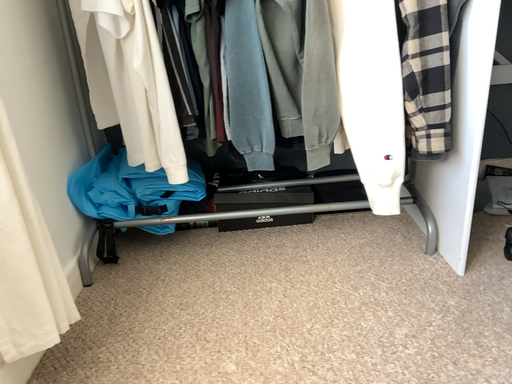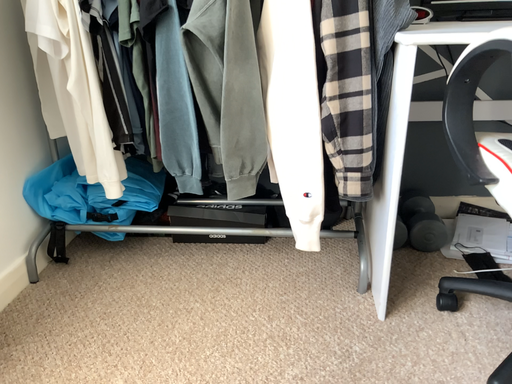
Question: Which way did the camera rotate in the video?

Choices:
 (A) rotated left
 (B) rotated right

Answer: (A)